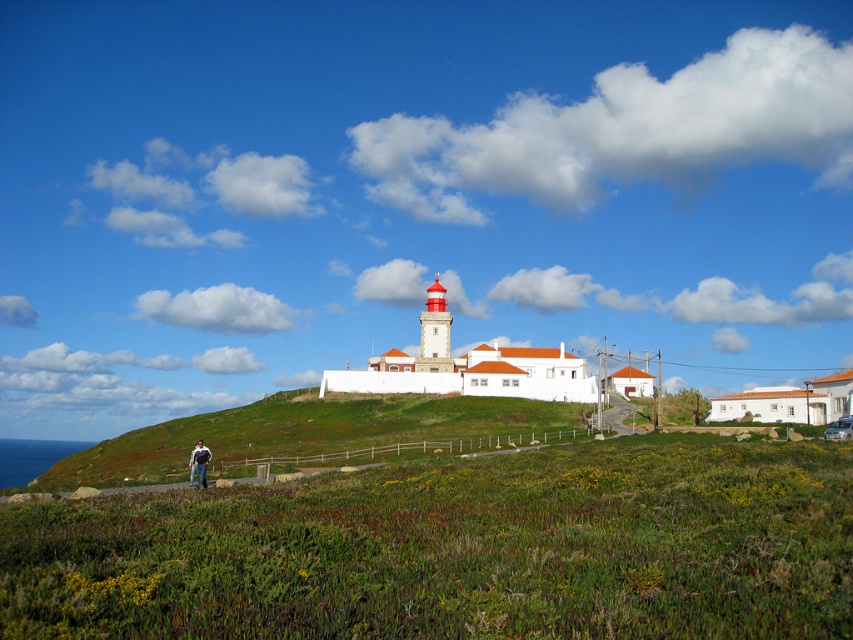
Question: Does green grassy at lower left appear under blue jeans at lower left?

Choices:
 (A) no
 (B) yes

Answer: (A)

Question: Among these points, which one is farthest from the camera?

Choices:
 (A) (155, 445)
 (B) (97, 554)

Answer: (A)

Question: Is green grassy at lower left positioned in front of green grassy hillside at lower left?

Choices:
 (A) no
 (B) yes

Answer: (B)

Question: Which point is farther to the camera?

Choices:
 (A) (196, 458)
 (B) (62, 484)
 (C) (61, 570)

Answer: (B)

Question: From the image, what is the correct spatial relationship of green grassy at lower left in relation to blue jeans at lower left?

Choices:
 (A) above
 (B) below

Answer: (A)

Question: Considering the real-world distances, which object is farthest from the green grassy hillside at lower left?

Choices:
 (A) green grassy at lower left
 (B) blue jeans at lower left

Answer: (A)